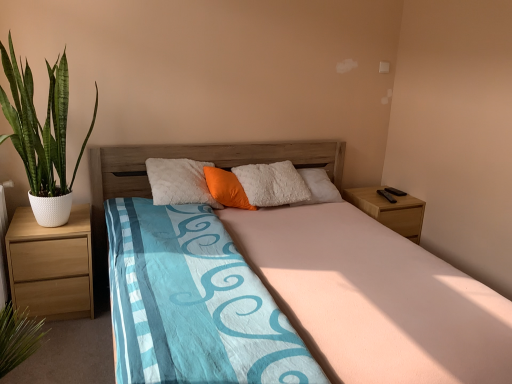
Question: Is orange fabric pillow at center not within wooden nightstand at right, the second nightstand viewed from the left?

Choices:
 (A) yes
 (B) no

Answer: (A)

Question: Is orange fabric pillow at center closer to the viewer compared to wooden nightstand at right, the second nightstand viewed from the left?

Choices:
 (A) no
 (B) yes

Answer: (B)

Question: Is orange fabric pillow at center oriented away from wooden nightstand at right, the second nightstand viewed from the left?

Choices:
 (A) yes
 (B) no

Answer: (B)

Question: Does orange fabric pillow at center have a greater width compared to wooden nightstand at right, the second nightstand viewed from the left?

Choices:
 (A) no
 (B) yes

Answer: (A)

Question: From a real-world perspective, is orange fabric pillow at center beneath wooden nightstand at right, which is counted as the first nightstand, starting from the back?

Choices:
 (A) no
 (B) yes

Answer: (A)

Question: Is orange fabric pillow at center further to camera compared to wooden nightstand at right, which is counted as the first nightstand, starting from the back?

Choices:
 (A) no
 (B) yes

Answer: (A)

Question: Can you confirm if wooden bed at center is positioned to the right of wooden nightstand at right, arranged as the second nightstand when viewed from the front?

Choices:
 (A) yes
 (B) no

Answer: (B)

Question: Is wooden bed at center next to wooden nightstand at right, which is the 1th nightstand in right-to-left order?

Choices:
 (A) no
 (B) yes

Answer: (A)

Question: Is wooden bed at center facing away from wooden nightstand at right, the second nightstand viewed from the left?

Choices:
 (A) yes
 (B) no

Answer: (B)

Question: Is wooden bed at center taller than wooden nightstand at right, the second nightstand viewed from the left?

Choices:
 (A) no
 (B) yes

Answer: (B)

Question: From the image's perspective, is wooden bed at center above wooden nightstand at right, which is the 1th nightstand in right-to-left order?

Choices:
 (A) no
 (B) yes

Answer: (A)

Question: Can you confirm if wooden bed at center is positioned to the left of wooden nightstand at right, which is counted as the first nightstand, starting from the back?

Choices:
 (A) no
 (B) yes

Answer: (B)

Question: Is wooden bed at center smaller than orange fabric pillow at center?

Choices:
 (A) yes
 (B) no

Answer: (B)